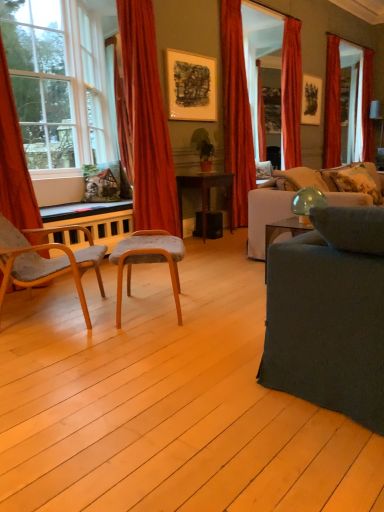
Where is `vacant space underneath gray fabric stool at center, the 2th chair positioned from the left (from a real-world perspective)`? The width and height of the screenshot is (384, 512). vacant space underneath gray fabric stool at center, the 2th chair positioned from the left (from a real-world perspective) is located at coordinates (148, 309).